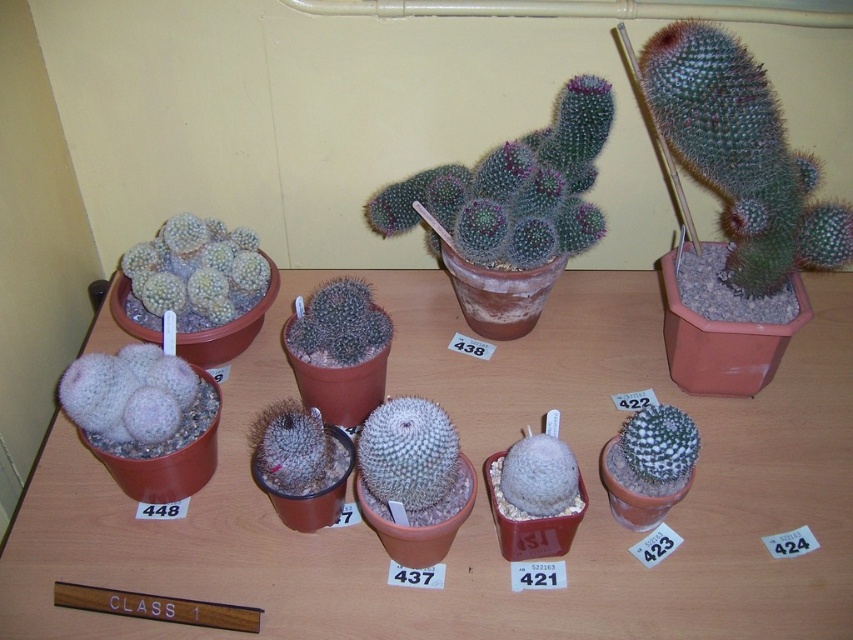
Between terracotta clay pots at center and white fuzzy cactus at upper left, which one appears on the left side from the viewer's perspective?

Positioned to the left is white fuzzy cactus at upper left.

Does point (503, 570) come farther from viewer compared to point (149, 301)?

That is False.

At what (x,y) coordinates should I click in order to perform the action: click on terracotta clay pots at center. Please return your answer as a coordinate pair (x, y). This screenshot has height=640, width=853. Looking at the image, I should click on (485, 493).

Does green spiky cactus at upper right have a greater height compared to succulent cactus at center?

Correct, green spiky cactus at upper right is much taller as succulent cactus at center.

In the scene shown: Does green spiky cactus at upper right appear on the left side of succulent cactus at center?

In fact, green spiky cactus at upper right is to the right of succulent cactus at center.

Who is more distant from viewer, (704, 152) or (350, 349)?

The point (350, 349) is behind.

Image resolution: width=853 pixels, height=640 pixels. In order to click on green spiky cactus at upper right in this screenshot , I will do `click(741, 156)`.

Between terracotta clay pots at center and green spiky cactus at upper right, which one has more height?

terracotta clay pots at center

Can you confirm if terracotta clay pots at center is positioned to the right of green spiky cactus at upper right?

Incorrect, terracotta clay pots at center is not on the right side of green spiky cactus at upper right.

Find the location of `terracotta clay pots at center`. terracotta clay pots at center is located at coordinates (485, 493).

Identify the location of terracotta clay pots at center. This screenshot has width=853, height=640. (485, 493).